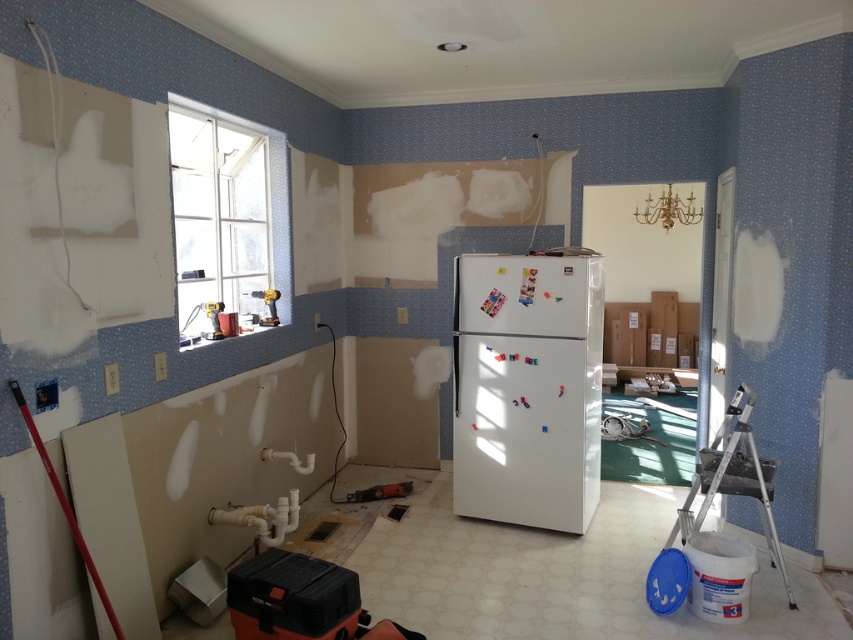
Question: Observing the image, what is the correct spatial positioning of white matte refrigerator at center in reference to silver metallic ladder at right?

Choices:
 (A) right
 (B) left

Answer: (B)

Question: Can you confirm if silver metallic ladder at right is smaller than metallic orange power tool at center?

Choices:
 (A) yes
 (B) no

Answer: (B)

Question: Is silver metallic ladder at right bigger than metallic orange power tool at center?

Choices:
 (A) yes
 (B) no

Answer: (A)

Question: Which of the following is the closest to the observer?

Choices:
 (A) pos(401,493)
 (B) pos(555,276)

Answer: (B)

Question: Which object is the farthest from the white matte refrigerator at center?

Choices:
 (A) silver metallic ladder at right
 (B) metallic orange power tool at center

Answer: (B)

Question: Among these objects, which one is farthest from the camera?

Choices:
 (A) white matte refrigerator at center
 (B) metallic orange power tool at center
 (C) silver metallic ladder at right

Answer: (B)